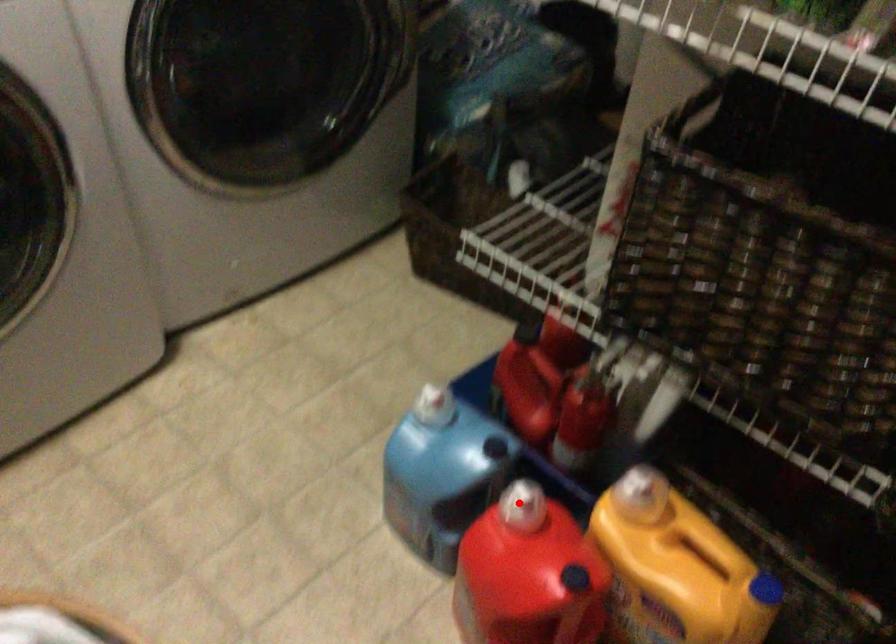
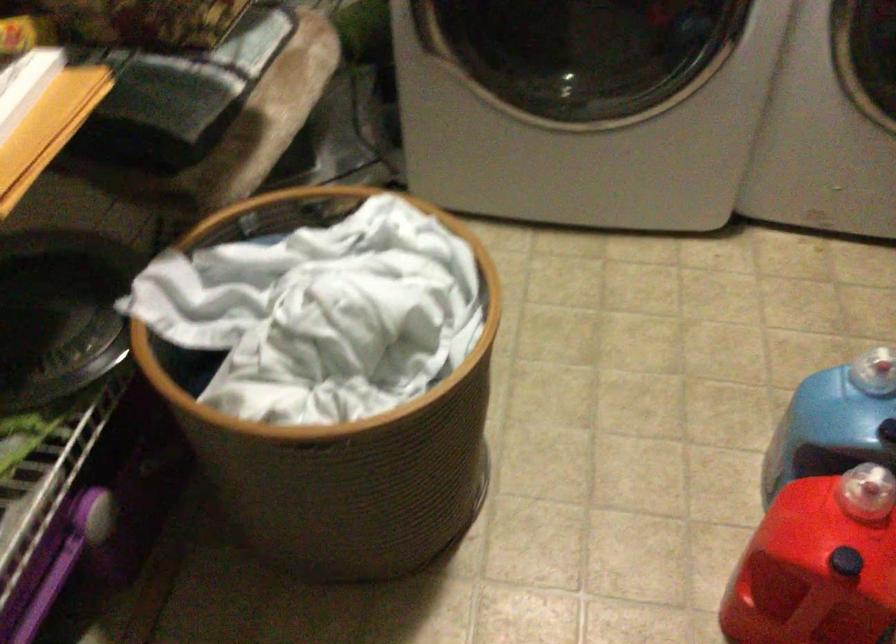
Question: A red point is marked in image1. In image2, is the corresponding 3D point closer to the camera or farther? Reply with the corresponding letter.

Choices:
 (A) The corresponding 3D point is closer.
 (B) The corresponding 3D point is farther.

Answer: (A)